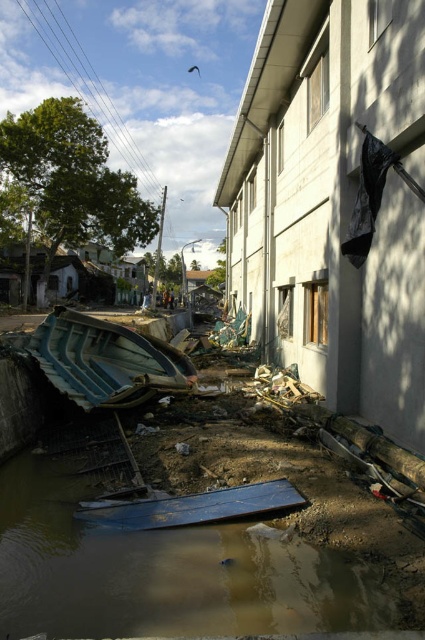
You are a rescue worker trying to navigate through the flooded area. You see the brown muddy water at lower left and the blue fiberglass boat at lower left. Which one takes up more space in the scene?

The brown muddy water at lower left is bigger than the blue fiberglass boat at lower left, so it takes up more space in the scene.

You are a rescue worker assessing the flooded area. You see the brown muddy water at lower left and the blue fiberglass boat at lower left. Which object is taller in this scene?

The blue fiberglass boat at lower left is taller than the brown muddy water at lower left.

You are a rescue worker trying to reach a stranded person located behind the large building with the damaged windows. Your path is blocked by the brown muddy water at lower left and the blue fiberglass boat at lower left. Given that your vehicle can only cross obstacles up to 5 meters wide, can you safely navigate around these two objects to reach the building?

The distance between the brown muddy water at lower left and blue fiberglass boat at lower left is 7.54 meters, which exceeds your vehicle maximum obstacle crossing width of 5 meters. Therefore, you cannot safely navigate around these two objects to reach the building.